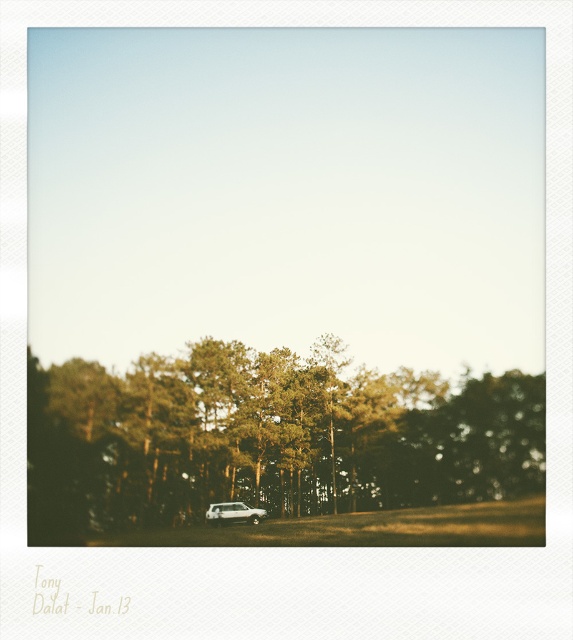
Question: Which of the following is the closest to the observer?

Choices:
 (A) (221, 508)
 (B) (284, 486)

Answer: (A)

Question: Is green matte tree at center to the left of white matte suv at center from the viewer's perspective?

Choices:
 (A) no
 (B) yes

Answer: (A)

Question: Does green matte tree at center appear on the left side of white matte suv at center?

Choices:
 (A) no
 (B) yes

Answer: (A)

Question: Is green matte tree at center to the left of white matte suv at center from the viewer's perspective?

Choices:
 (A) yes
 (B) no

Answer: (B)